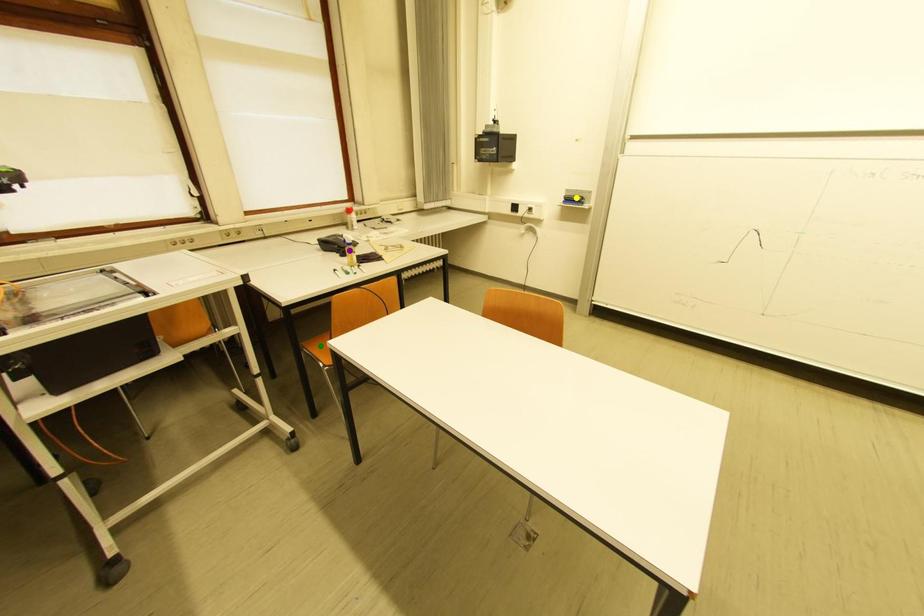
Order these from nearest to farthest:
1. green point
2. yellow point
3. purple point

green point < purple point < yellow point